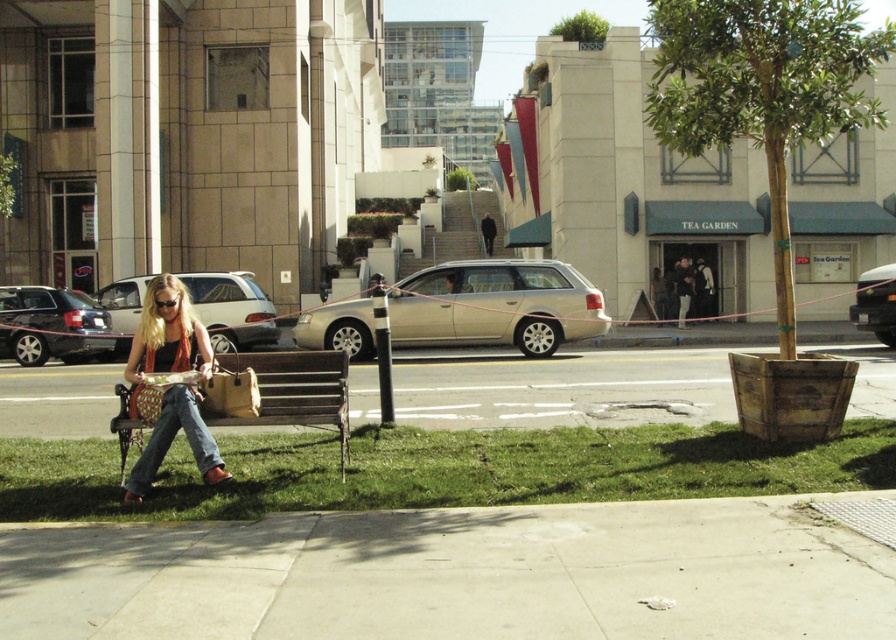
Question: Can you confirm if smooth concrete pavement at lower center is bigger than matte silver minivan at center?

Choices:
 (A) yes
 (B) no

Answer: (A)

Question: Among these objects, which one is nearest to the camera?

Choices:
 (A) brown wooden bench at lower left
 (B) denim jeans at lower left
 (C) smooth concrete pavement at lower center
 (D) denim at lower left

Answer: (D)

Question: Is concrete at lower center positioned behind satin gold station wagon at center?

Choices:
 (A) no
 (B) yes

Answer: (A)

Question: Observing the image, what is the correct spatial positioning of satin gold station wagon at center in reference to denim jeans at lower left?

Choices:
 (A) left
 (B) right

Answer: (B)

Question: Among these points, which one is farthest from the camera?

Choices:
 (A) (x=222, y=330)
 (B) (x=877, y=312)
 (C) (x=498, y=499)
 (D) (x=730, y=522)

Answer: (A)

Question: Which is farther from the matte silver minivan at center?

Choices:
 (A) smooth concrete pavement at lower center
 (B) matte black sedan at left
 (C) denim at lower left

Answer: (C)